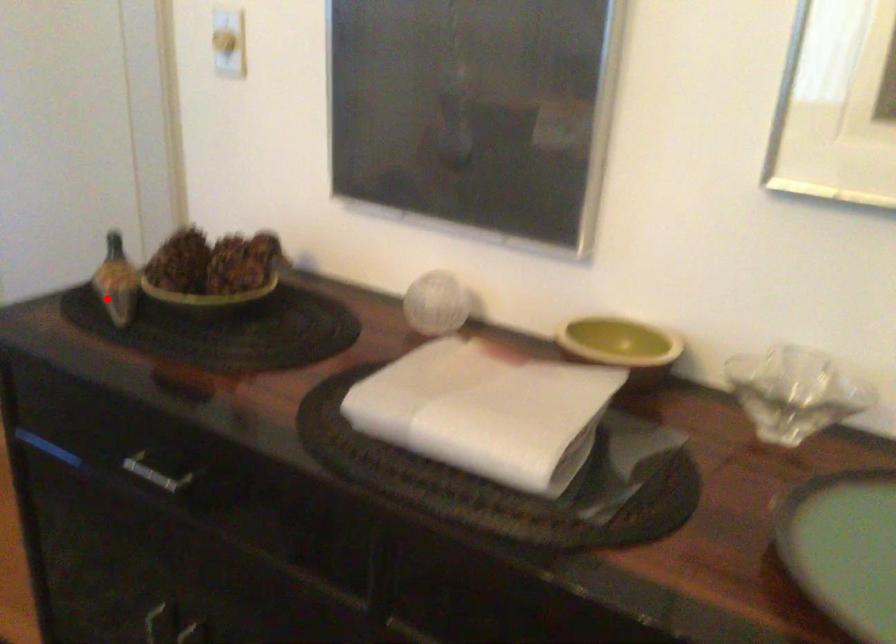
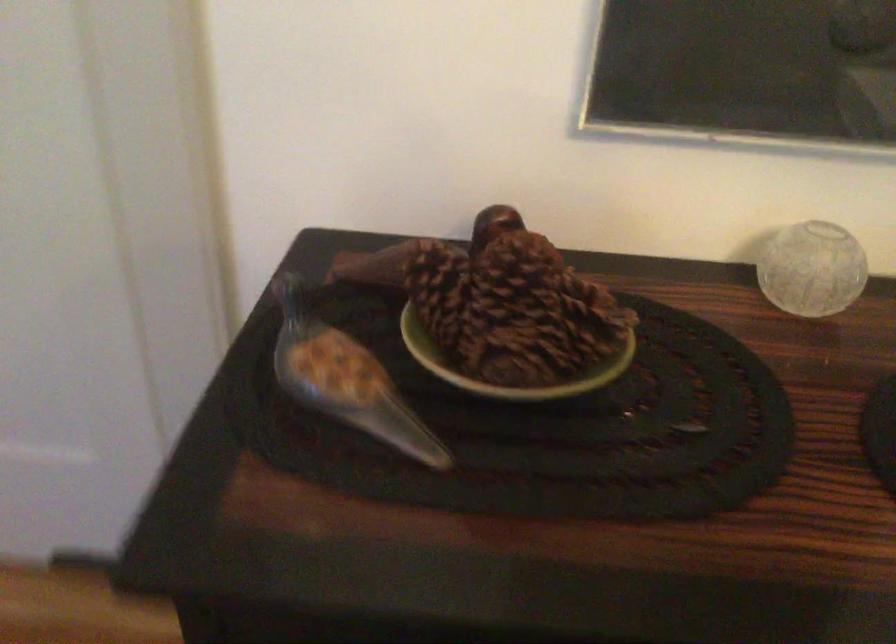
Question: I am providing you with two images of the same scene from different viewpoints. Image1 has a red point marked. In image2, the corresponding 3D location appears at what relative position? Reply with the corresponding letter.

Choices:
 (A) Closer
 (B) Farther

Answer: (A)